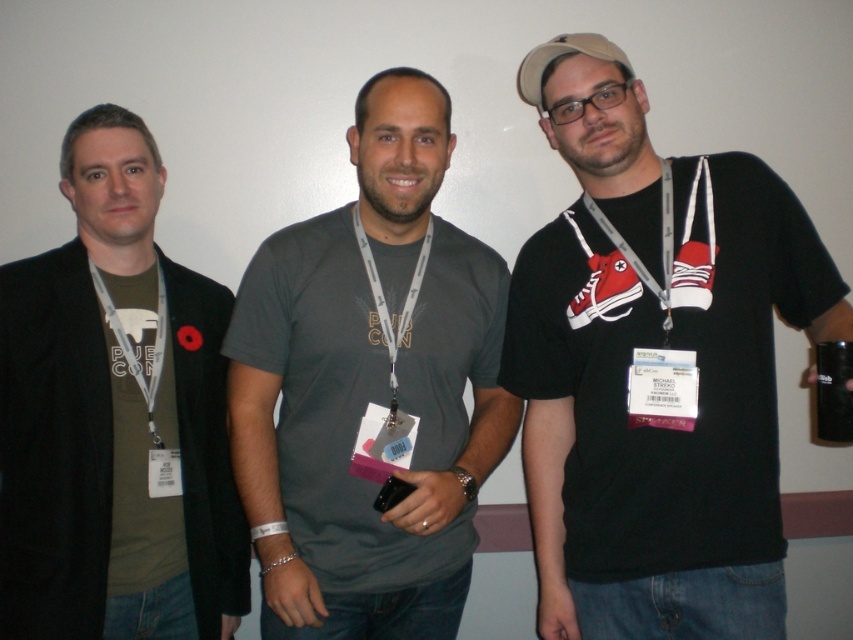
You are a photographer adjusting your camera settings to capture the three people in the image. You notice the matte gray shirt at center and the gray fabric lanyard at center. Which object is wider when viewed from your camera position?

The matte gray shirt at center is wider than the gray fabric lanyard at center according to the description.

Please describe the position of the gray fabric lanyard at center in the image using coordinates. The scene shows three people standing against a white wall, each wearing lanyards with badges. The individuals include a person on the left with a red poppy flower, one in the middle with a PUB CON shirt, and another on the right. All are facing the camera. You must use the exact object labels from the provided list in your answer. Do not mention any other details beyond what is given.

The gray fabric lanyard at center is located at coordinates point (389, 317).